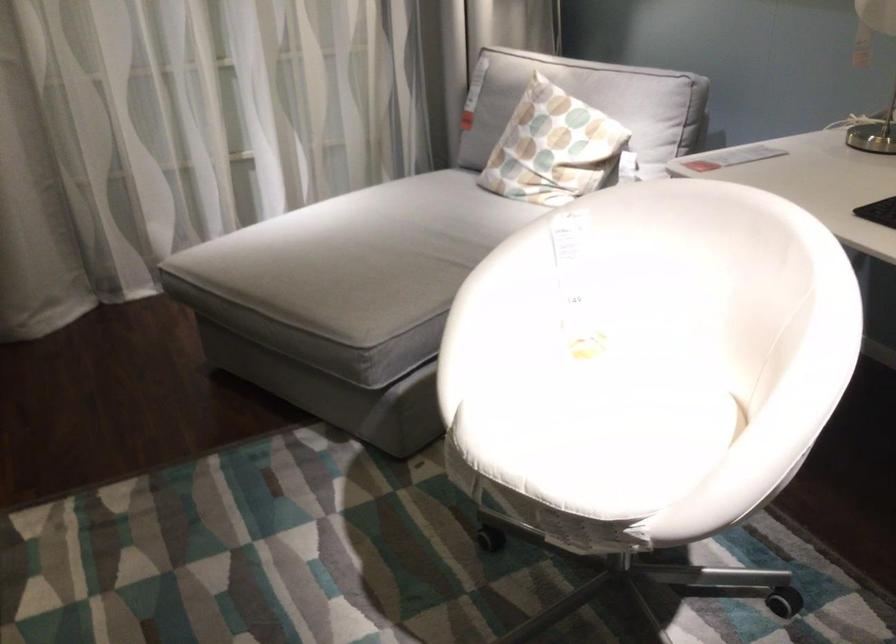
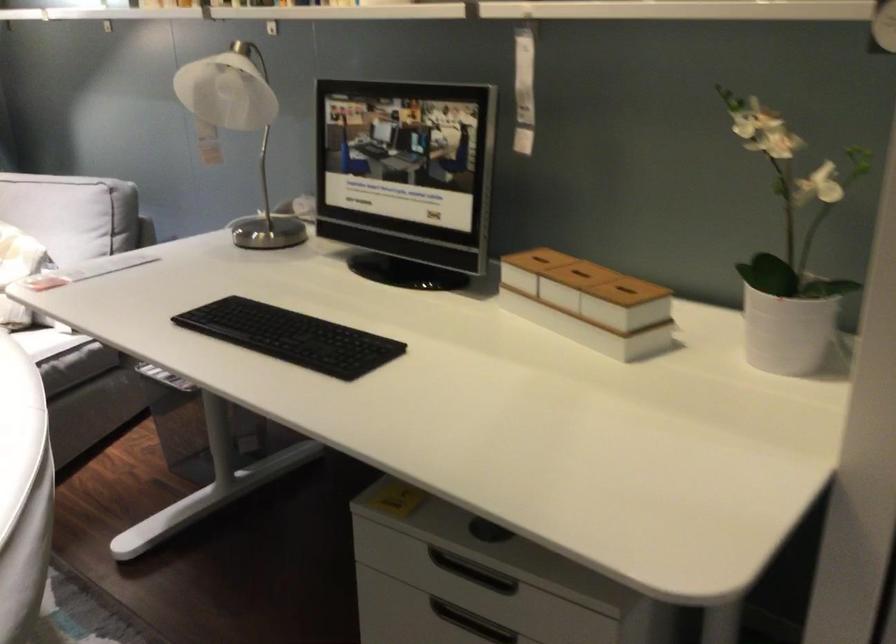
Question: In a continuous first-person perspective shot, in which direction is the camera moving?

Choices:
 (A) Left
 (B) Right
 (C) Forward
 (D) Backward

Answer: (B)